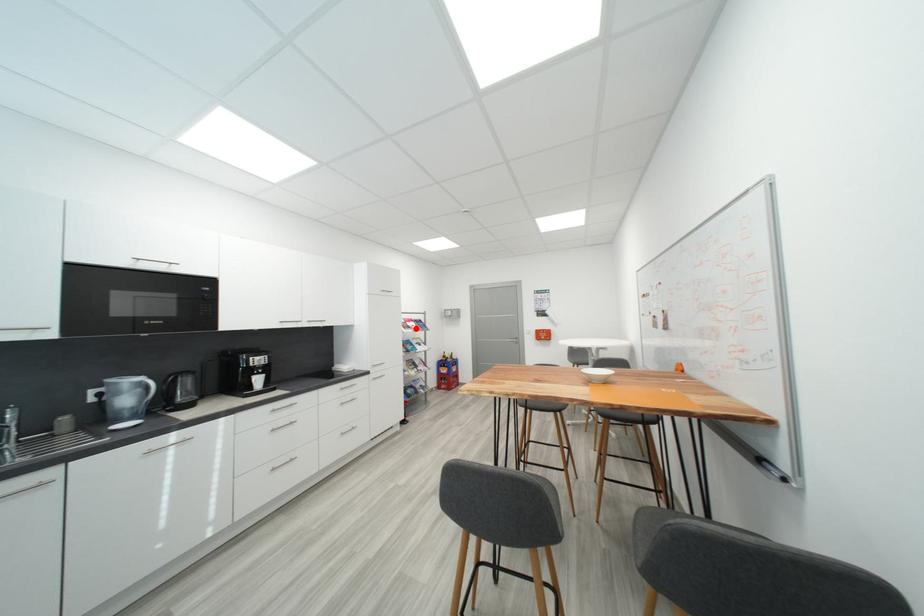
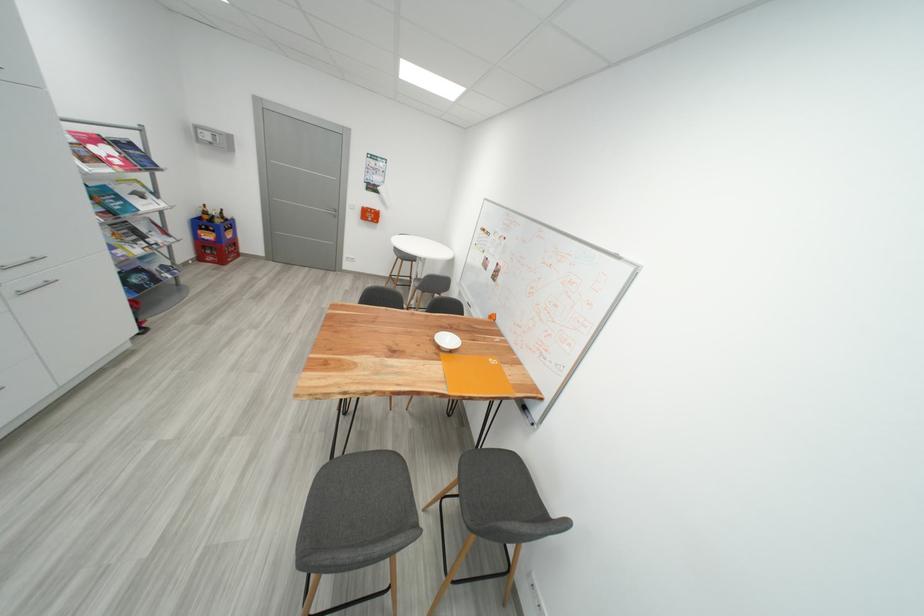
Find the pixel in the second image that matches the highlighted location in the first image.

(104, 161)